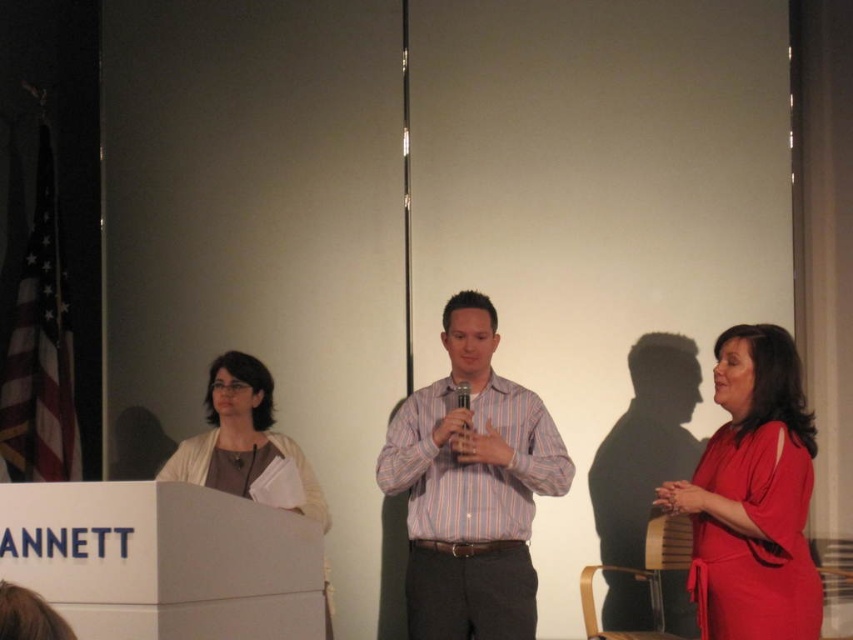
Which of these two, striped cotton shirt at center or matte white blouse at center, stands taller?

With more height is striped cotton shirt at center.

In the scene shown: Is striped cotton shirt at center to the left of matte white blouse at center from the viewer's perspective?

Incorrect, striped cotton shirt at center is not on the left side of matte white blouse at center.

Which is in front, point (462, 536) or point (265, 432)?

Positioned in front is point (462, 536).

Where is `striped cotton shirt at center`? striped cotton shirt at center is located at coordinates point(471,486).

Identify the location of matte red dress at right. This screenshot has width=853, height=640. (752, 497).

Locate an element on the screen. This screenshot has height=640, width=853. matte red dress at right is located at coordinates (752, 497).

Does striped cotton shirt at center have a greater width compared to matte red dress at right?

Indeed, striped cotton shirt at center has a greater width compared to matte red dress at right.

Does striped cotton shirt at center appear over matte red dress at right?

Yes, striped cotton shirt at center is above matte red dress at right.

What do you see at coordinates (471, 486) in the screenshot?
I see `striped cotton shirt at center` at bounding box center [471, 486].

At what (x,y) coordinates should I click in order to perform the action: click on striped cotton shirt at center. Please return your answer as a coordinate pair (x, y). Image resolution: width=853 pixels, height=640 pixels. Looking at the image, I should click on (471, 486).